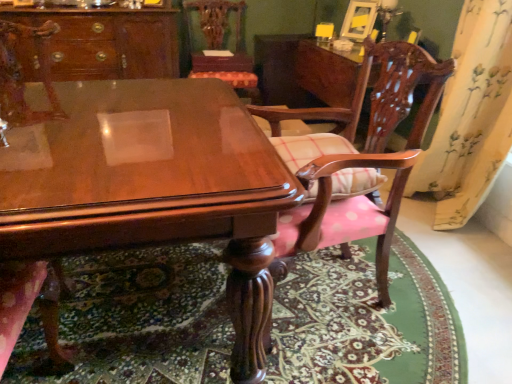
Question: Are carpeted floor at lower center and polished wood chair at lower left, which is the third chair in back-to-front order, far apart?

Choices:
 (A) no
 (B) yes

Answer: (B)

Question: From a real-world perspective, is carpeted floor at lower center under polished wood chair at lower left, marked as the first chair in a front-to-back arrangement?

Choices:
 (A) no
 (B) yes

Answer: (B)

Question: Is carpeted floor at lower center next to polished wood chair at lower left, which is the third chair in back-to-front order, and touching it?

Choices:
 (A) no
 (B) yes

Answer: (A)

Question: Considering the relative sizes of carpeted floor at lower center and polished wood chair at lower left, which is the third chair in back-to-front order, in the image provided, is carpeted floor at lower center shorter than polished wood chair at lower left, which is the third chair in back-to-front order,?

Choices:
 (A) yes
 (B) no

Answer: (A)

Question: Would you say polished wood chair at lower left, which is the third chair in back-to-front order, is part of carpeted floor at lower center's contents?

Choices:
 (A) yes
 (B) no

Answer: (B)

Question: Is point (306, 231) positioned closer to the camera than point (66, 119)?

Choices:
 (A) farther
 (B) closer

Answer: (A)

Question: Is wooden chair with cushion at center, the second chair in the back-to-front sequence, wider or thinner than glossy wood table at center?

Choices:
 (A) wide
 (B) thin

Answer: (B)

Question: Considering their positions, is wooden chair with cushion at center, the second chair in the back-to-front sequence, located in front of or behind glossy wood table at center?

Choices:
 (A) front
 (B) behind

Answer: (B)

Question: Visually, is wooden chair with cushion at center, the second chair in the back-to-front sequence, positioned to the left or to the right of glossy wood table at center?

Choices:
 (A) left
 (B) right

Answer: (B)

Question: Is glossy wood cabinet at upper left taller or shorter than yellow floral fabric at right?

Choices:
 (A) short
 (B) tall

Answer: (A)

Question: Is glossy wood cabinet at upper left bigger or smaller than yellow floral fabric at right?

Choices:
 (A) big
 (B) small

Answer: (A)

Question: Relative to yellow floral fabric at right, is glossy wood cabinet at upper left in front or behind?

Choices:
 (A) front
 (B) behind

Answer: (B)

Question: Would you say glossy wood cabinet at upper left is to the left or to the right of yellow floral fabric at right in the picture?

Choices:
 (A) right
 (B) left

Answer: (B)

Question: From a real-world perspective, relative to glossy wood table at center, is carpeted floor at lower center vertically above or below?

Choices:
 (A) above
 (B) below

Answer: (B)

Question: Considering the positions of carpeted floor at lower center and glossy wood table at center in the image, is carpeted floor at lower center wider or thinner than glossy wood table at center?

Choices:
 (A) wide
 (B) thin

Answer: (B)